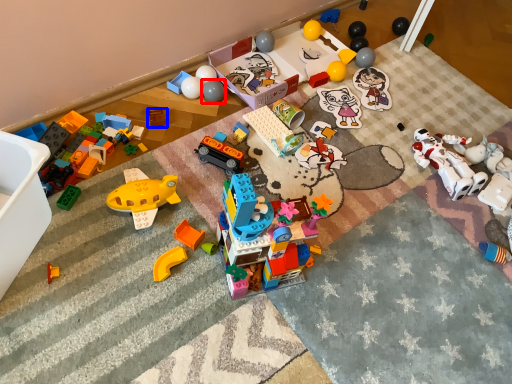
Question: Among these objects, which one is farthest to the camera, toy (highlighted by a red box) or toy (highlighted by a blue box)?

Choices:
 (A) toy
 (B) toy

Answer: (A)